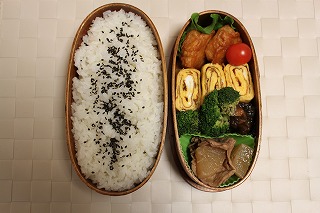
Find the location of a particular element. Image resolution: width=320 pixels, height=213 pixels. bowl is located at coordinates (187, 147).